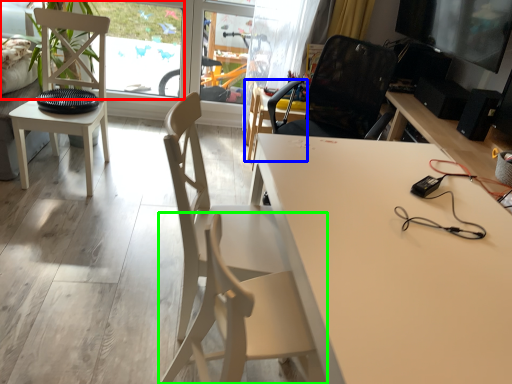
Question: Considering the real-world distances, which object is closest to window screen (highlighted by a red box)? chair (highlighted by a blue box) or chair (highlighted by a green box).

Choices:
 (A) chair
 (B) chair

Answer: (A)